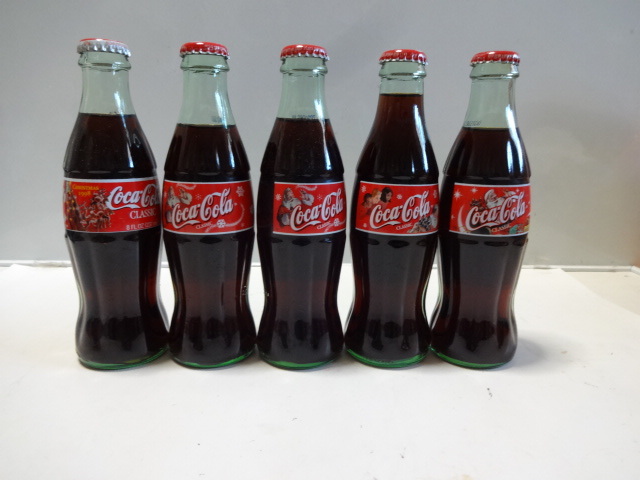
In order to click on bottles of coke in this screenshot , I will do `click(106, 285)`, `click(214, 294)`, `click(306, 286)`, `click(397, 288)`, `click(492, 306)`.